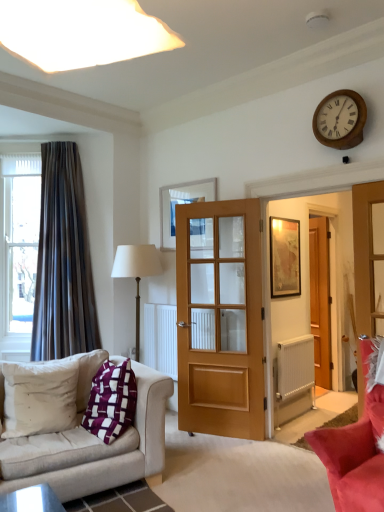
Question: Can you confirm if beige fabric couch at lower left, the 1th studio couch positioned from the left, is taller than wooden wall clock at upper right?

Choices:
 (A) no
 (B) yes

Answer: (B)

Question: Is there a large distance between beige fabric couch at lower left, the 2th studio couch viewed from the right, and wooden wall clock at upper right?

Choices:
 (A) yes
 (B) no

Answer: (A)

Question: From a real-world perspective, is beige fabric couch at lower left, the 1th studio couch positioned from the left, located higher than wooden wall clock at upper right?

Choices:
 (A) yes
 (B) no

Answer: (B)

Question: Is wooden wall clock at upper right inside beige fabric couch at lower left, the 1th studio couch positioned from the left?

Choices:
 (A) yes
 (B) no

Answer: (B)

Question: Can you confirm if beige fabric couch at lower left, the 2th studio couch viewed from the right, is shorter than wooden wall clock at upper right?

Choices:
 (A) no
 (B) yes

Answer: (A)

Question: Is beige fabric couch at lower left, the 1th studio couch positioned from the left, looking in the opposite direction of wooden wall clock at upper right?

Choices:
 (A) yes
 (B) no

Answer: (B)

Question: Can you confirm if clear glass window at left is shorter than dark grey velvet curtain at left?

Choices:
 (A) no
 (B) yes

Answer: (B)

Question: From the image's perspective, would you say clear glass window at left is shown under dark grey velvet curtain at left?

Choices:
 (A) yes
 (B) no

Answer: (A)

Question: Does clear glass window at left have a lesser width compared to dark grey velvet curtain at left?

Choices:
 (A) no
 (B) yes

Answer: (B)

Question: Does clear glass window at left have a larger size compared to dark grey velvet curtain at left?

Choices:
 (A) no
 (B) yes

Answer: (A)

Question: From a real-world perspective, is clear glass window at left below dark grey velvet curtain at left?

Choices:
 (A) no
 (B) yes

Answer: (A)

Question: Is clear glass window at left behind dark grey velvet curtain at left?

Choices:
 (A) no
 (B) yes

Answer: (B)

Question: Is wooden door at center, the 1th door from the back, to the right of matte gold picture frame at center-right, which is the 1th picture frame from right to left, from the viewer's perspective?

Choices:
 (A) yes
 (B) no

Answer: (A)